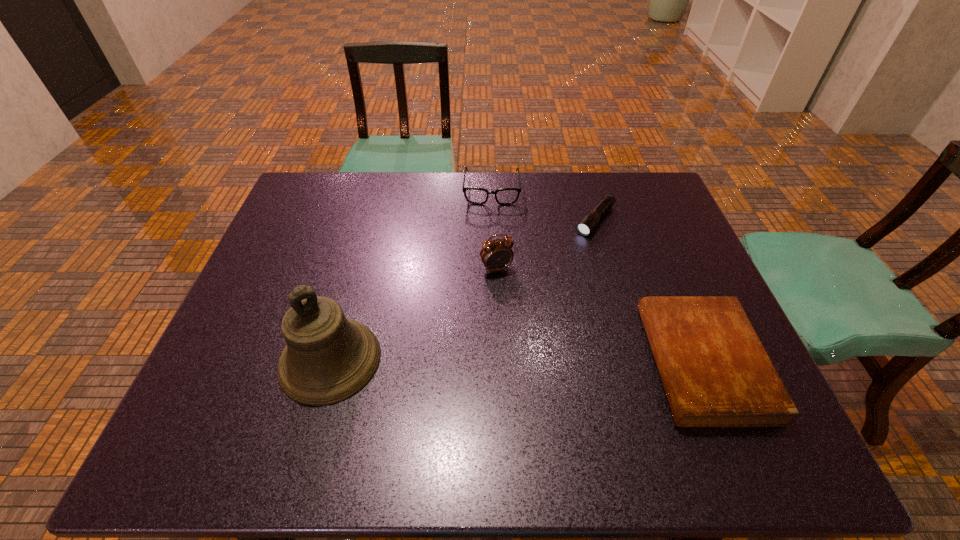
Find the location of a particular element. The height and width of the screenshot is (540, 960). the leftmost object is located at coordinates (328, 358).

Identify the location of bell. Image resolution: width=960 pixels, height=540 pixels. (328, 358).

I want to click on Bible, so click(x=715, y=371).

Locate an element on the screen. Image resolution: width=960 pixels, height=540 pixels. flashlight is located at coordinates (590, 221).

The width and height of the screenshot is (960, 540). What are the coordinates of `spectacles` in the screenshot? It's located at (504, 196).

Find the location of a particular element. alarm clock is located at coordinates coord(495,255).

Locate an element on the screen. The height and width of the screenshot is (540, 960). the third nearest object is located at coordinates (495, 255).

Identify the location of free space located on the right of the tallest object. The height and width of the screenshot is (540, 960). (424, 360).

This screenshot has width=960, height=540. Find the location of `free location located 0.370m on the spine side of the Bible`. free location located 0.370m on the spine side of the Bible is located at coordinates (489, 362).

I want to click on vacant space located 0.190m on the spine side of the Bible, so click(x=568, y=362).